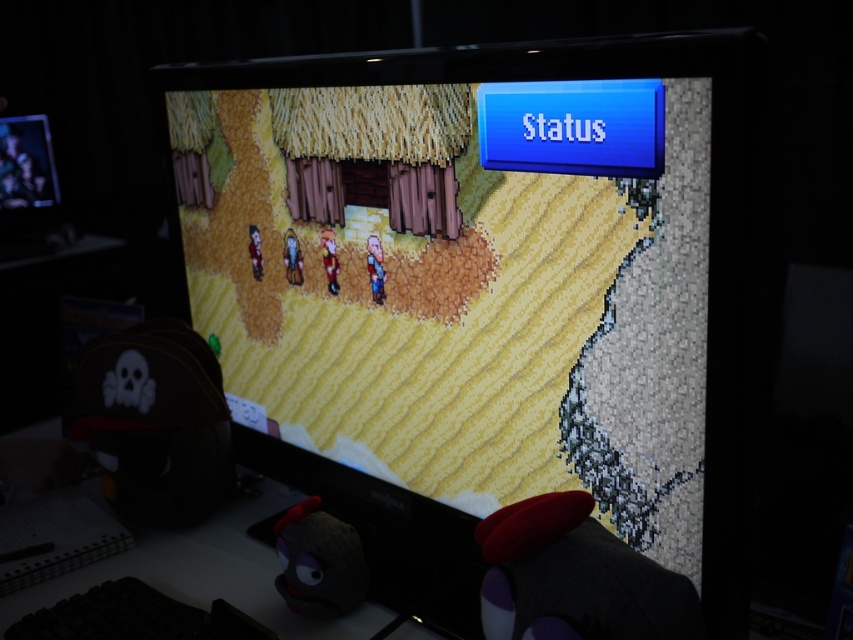
Question: Which object appears farthest from the camera in this image?

Choices:
 (A) fuzzy gray plush at lower center
 (B) matte black monitor at center
 (C) white matte desk at lower left
 (D) matte black monitor at upper left

Answer: (D)

Question: Which is farther from the matte black monitor at upper left?

Choices:
 (A) fuzzy gray plush at lower center
 (B) white matte desk at lower left
 (C) matte black plush at lower left
 (D) matte black monitor at center

Answer: (A)

Question: Which object is the closest to the matte black monitor at center?

Choices:
 (A) matte black monitor at upper left
 (B) white matte desk at lower left

Answer: (B)

Question: Is matte black plush at lower left below white matte desk at lower left?

Choices:
 (A) no
 (B) yes

Answer: (A)

Question: Considering the relative positions of matte black monitor at center and matte black monitor at upper left in the image provided, where is matte black monitor at center located with respect to matte black monitor at upper left?

Choices:
 (A) below
 (B) above

Answer: (A)

Question: Is matte black monitor at center positioned before fuzzy gray plush at lower center?

Choices:
 (A) yes
 (B) no

Answer: (A)